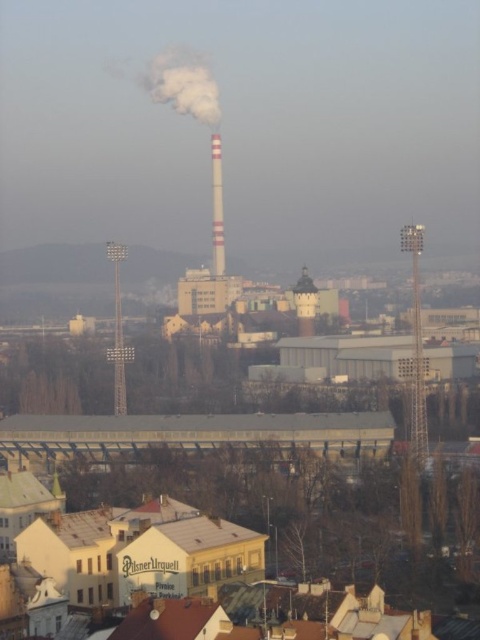
Can you confirm if white smoke at upper center is positioned below white glossy chimney at center?

Incorrect, white smoke at upper center is not positioned below white glossy chimney at center.

Is white smoke at upper center positioned behind white glossy chimney at center?

Yes.

Who is more forward, [212,100] or [214,211]?

Point [214,211] is more forward.

Identify the location of white smoke at upper center. (182, 83).

Is white smoke at upper center to the right of smooth white chimney at center from the viewer's perspective?

In fact, white smoke at upper center is to the left of smooth white chimney at center.

Can you confirm if white smoke at upper center is wider than smooth white chimney at center?

Correct, the width of white smoke at upper center exceeds that of smooth white chimney at center.

Is point (204, 68) positioned in front of point (303, 321)?

No, it is not.

Image resolution: width=480 pixels, height=640 pixels. Identify the location of white smoke at upper center. (182, 83).

Which is more to the right, white glossy chimney at center or smooth white chimney at center?

Positioned to the right is smooth white chimney at center.

Does white glossy chimney at center have a greater width compared to smooth white chimney at center?

In fact, white glossy chimney at center might be narrower than smooth white chimney at center.

Does point (213, 196) come closer to viewer compared to point (311, 305)?

No, it is not.

Find the location of a particular element. The height and width of the screenshot is (640, 480). white glossy chimney at center is located at coordinates [216, 205].